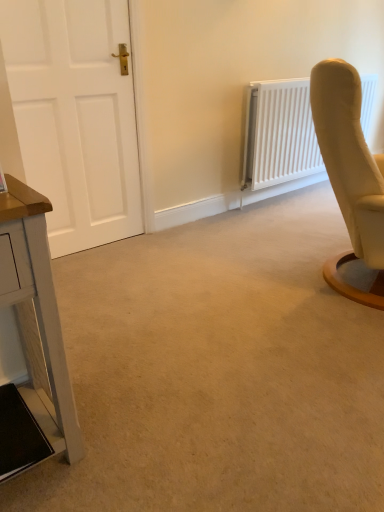
Question: Relative to white matte door at left, is white painted wood table at left in front or behind?

Choices:
 (A) behind
 (B) front

Answer: (B)

Question: Do you think white painted wood table at left is within white matte door at left, or outside of it?

Choices:
 (A) outside
 (B) inside

Answer: (A)

Question: Which of these objects is positioned farthest from the white painted wood table at left?

Choices:
 (A) white matte radiator at upper right
 (B) white matte door at left

Answer: (A)

Question: Considering the real-world distances, which object is closest to the white painted wood table at left?

Choices:
 (A) white matte radiator at upper right
 (B) white matte door at left

Answer: (B)